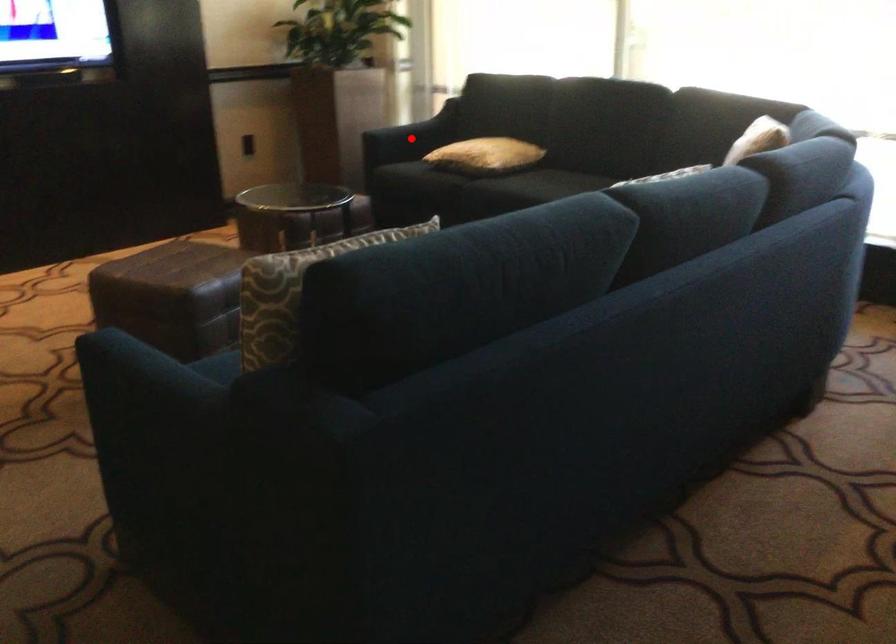
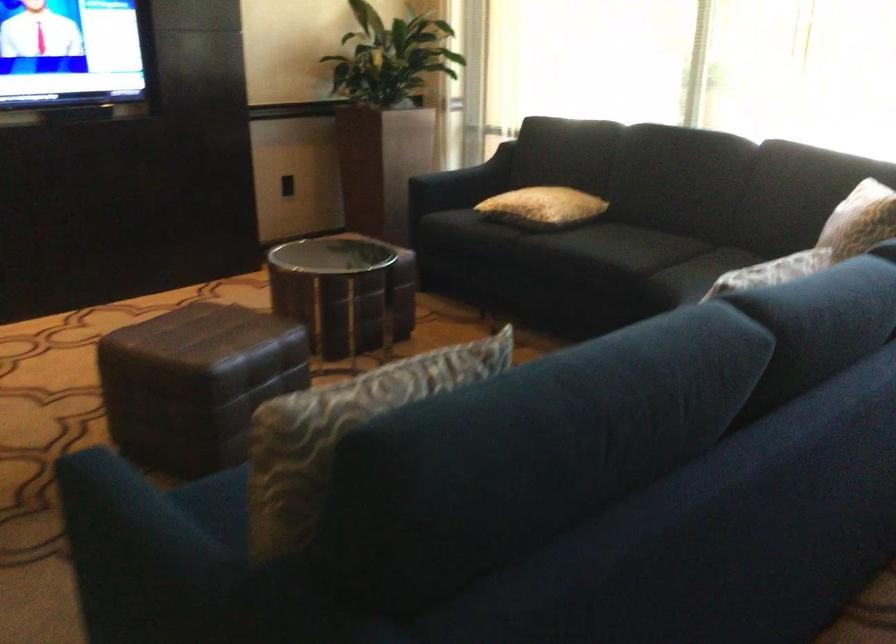
Question: I am providing you with two images of the same scene from different viewpoints. In image1, a red point is highlighted. Considering the same 3D point in image2, which of the following is correct?

Choices:
 (A) It is closer
 (B) It is farther

Answer: (A)